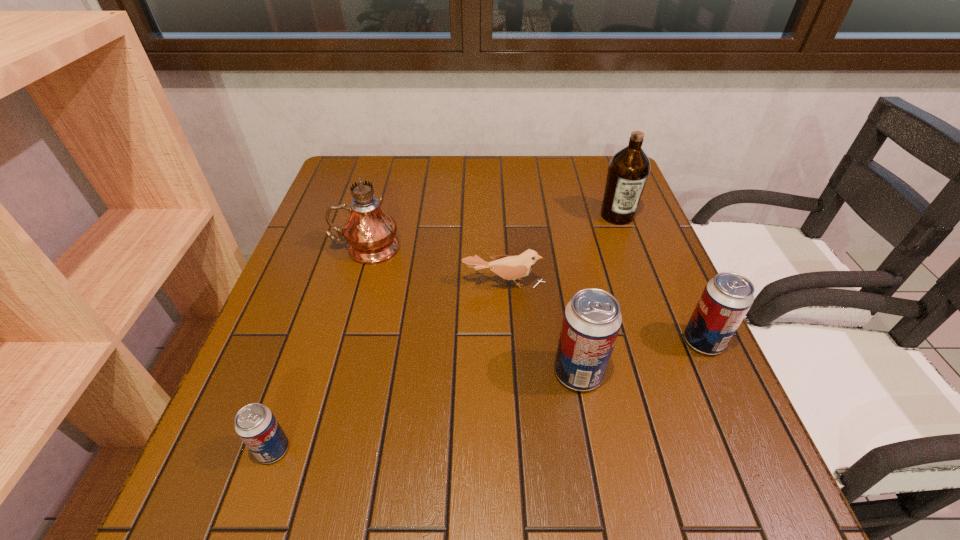
Identify which object is the third nearest to the second farthest object. Please provide its 2D coordinates. Your answer should be formatted as a tuple, i.e. [(x, y)], where the tuple contains the x and y coordinates of a point satisfying the conditions above.

[(255, 424)]

Where is `beer can that is the closest to the second beer can from left to right`? beer can that is the closest to the second beer can from left to right is located at coordinates (726, 299).

Locate which beer can ranks third in proximity to the fourth nearest object. Please provide its 2D coordinates. Your answer should be formatted as a tuple, i.e. [(x, y)], where the tuple contains the x and y coordinates of a point satisfying the conditions above.

[(255, 424)]

You are a GUI agent. You are given a task and a screenshot of the screen. Output one action in this format:
    pyautogui.click(x=<x>, y=<y>)
    Task: Click on the vacant area in the image that satisfies the following two spatial constraints: 1. at the beak of the bird; 2. on the right side of the second tallest beer can
    
    Given the screenshot: What is the action you would take?
    pyautogui.click(x=507, y=341)

The image size is (960, 540). Identify the location of vacant space that satisfies the following two spatial constraints: 1. on the back side of the second beer can from right to left; 2. on the left side of the shortest beer can. (300, 373).